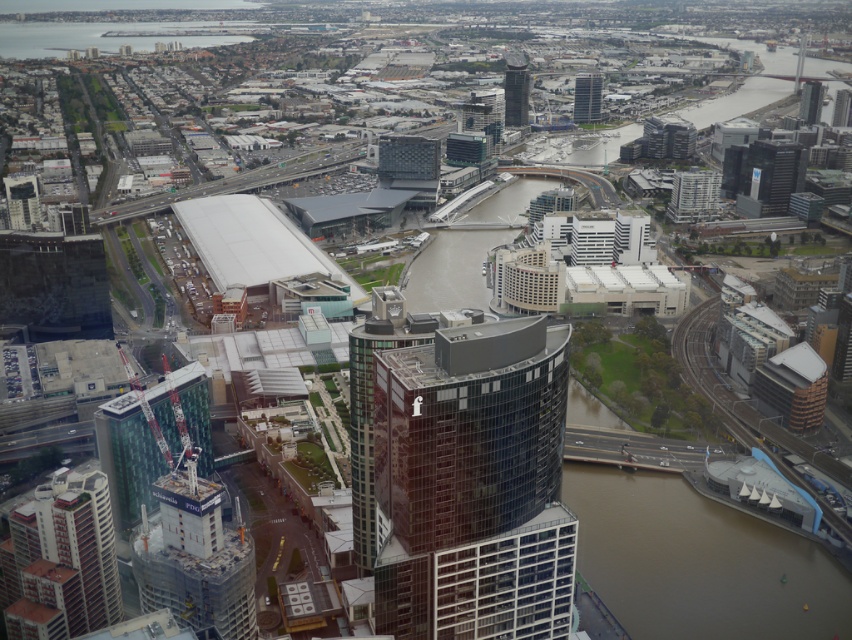
Question: Is red brick building at lower left to the right of green glass building at lower left from the viewer's perspective?

Choices:
 (A) yes
 (B) no

Answer: (B)

Question: Does black glass skyscraper at upper right have a smaller size compared to glassy reflective skyscraper at upper right?

Choices:
 (A) no
 (B) yes

Answer: (A)

Question: Estimate the real-world distances between objects in this image. Which object is closer to the dark glass skyscraper at center?

Choices:
 (A) glassy reflective skyscraper at upper center
 (B) concrete construction crane at lower left
 (C) black glass skyscraper at upper right
 (D) glassy reflective skyscraper at upper right

Answer: (B)

Question: Which point is closer to the camera?

Choices:
 (A) (68, 632)
 (B) (580, 86)

Answer: (A)

Question: Which of the following is the farthest from the observer?

Choices:
 (A) (741, 625)
 (B) (514, 108)
 (C) (583, 109)

Answer: (C)

Question: Does brown water at lower right appear on the right side of glassy reflective skyscraper at upper center?

Choices:
 (A) no
 (B) yes

Answer: (B)